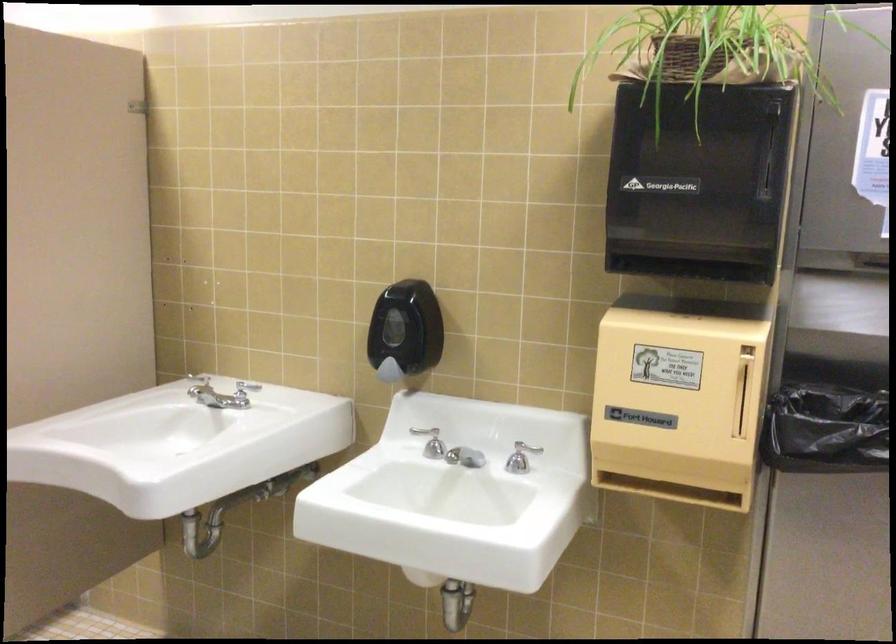
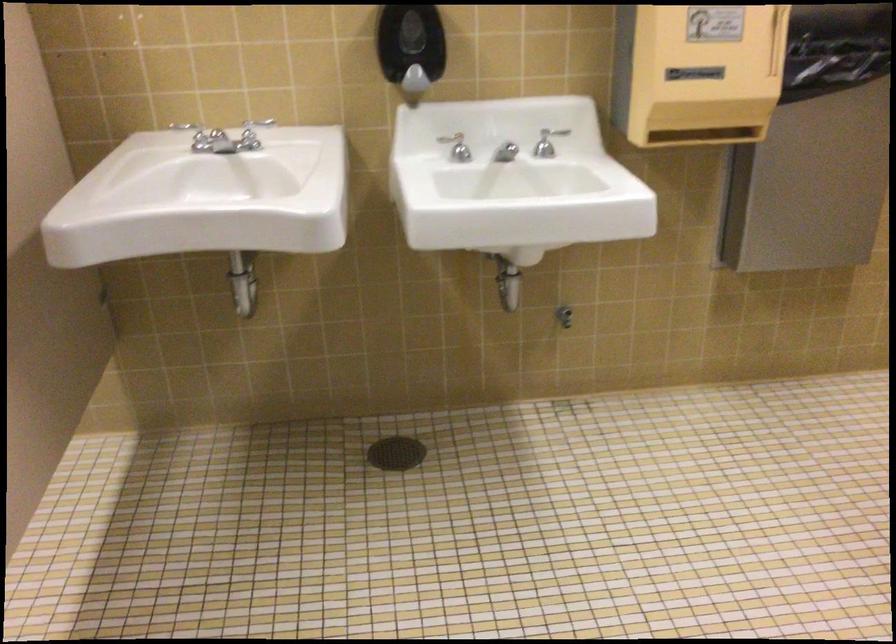
Where in the second image is the point corresponding to the point at 490,453 from the first image?

(505, 152)